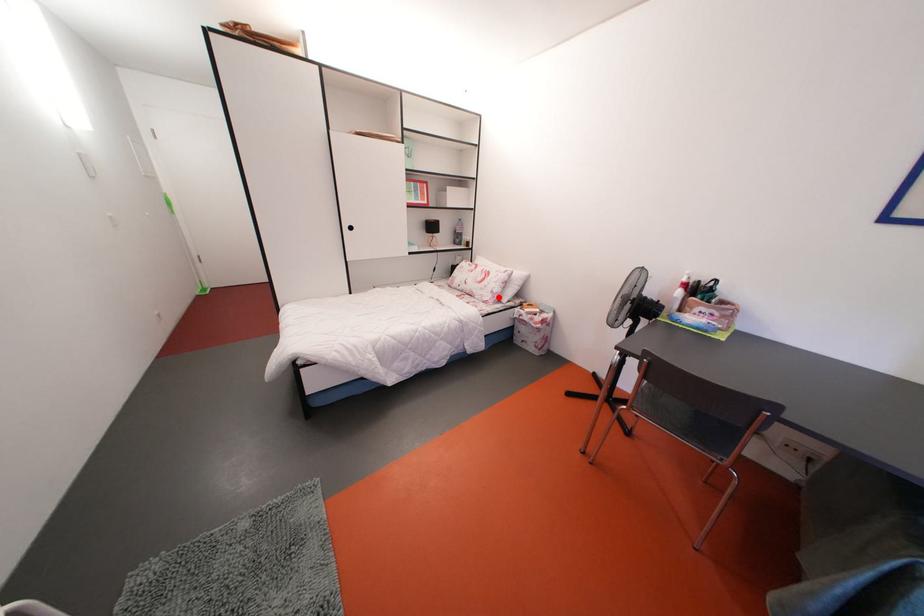
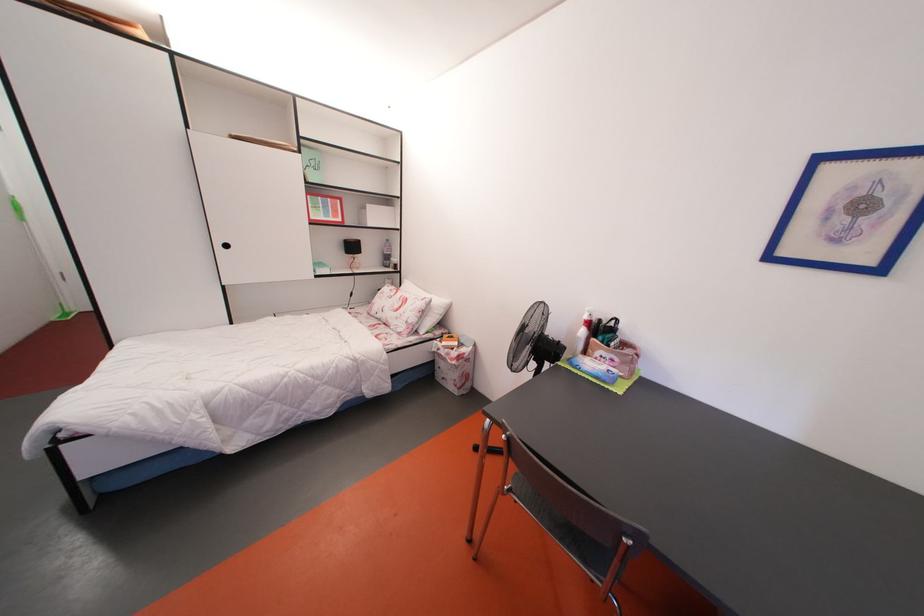
Question: I am providing you with two images of the same scene from different viewpoints. Image1 has a red point marked. In image2, the corresponding 3D location appears at what relative position? Reply with the corresponding letter.

Choices:
 (A) Closer
 (B) Farther

Answer: (B)